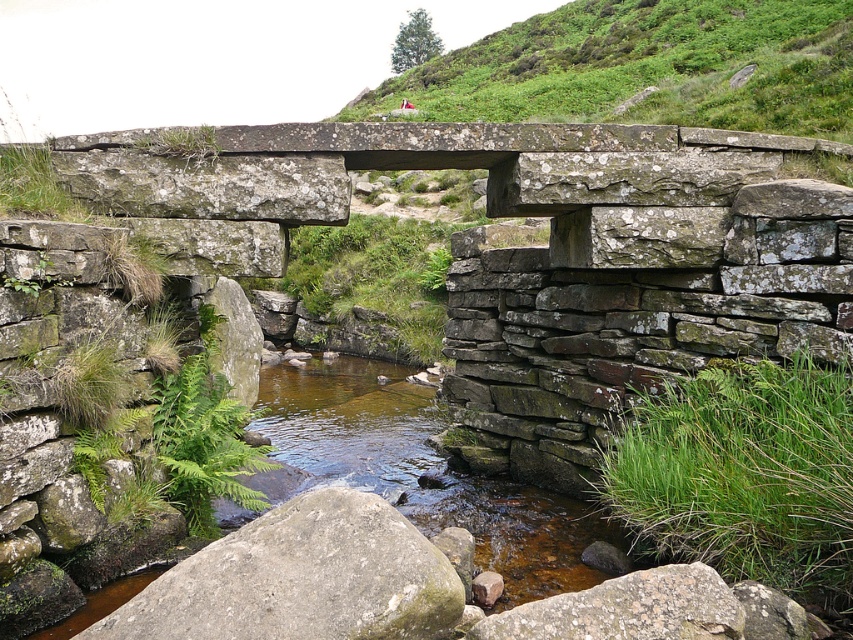
You are a hiker standing on the gray rough rock at center and want to climb up to the green grassy hillside at upper center. Which direction should you move to reach the hillside?

The green grassy hillside at upper center is positioned on the right side of gray rough rock at center, so you should move to the right to reach the hillside.

You are a hiker planning to cross the rustic stone bridge over the stream. You need to determine the highest point between the green grassy hillside at upper center and the gray rough rock at center. Which one should you choose to get a better view?

The green grassy hillside at upper center has a greater height compared to the gray rough rock at center, so choosing the green grassy hillside at upper center will provide a better view.